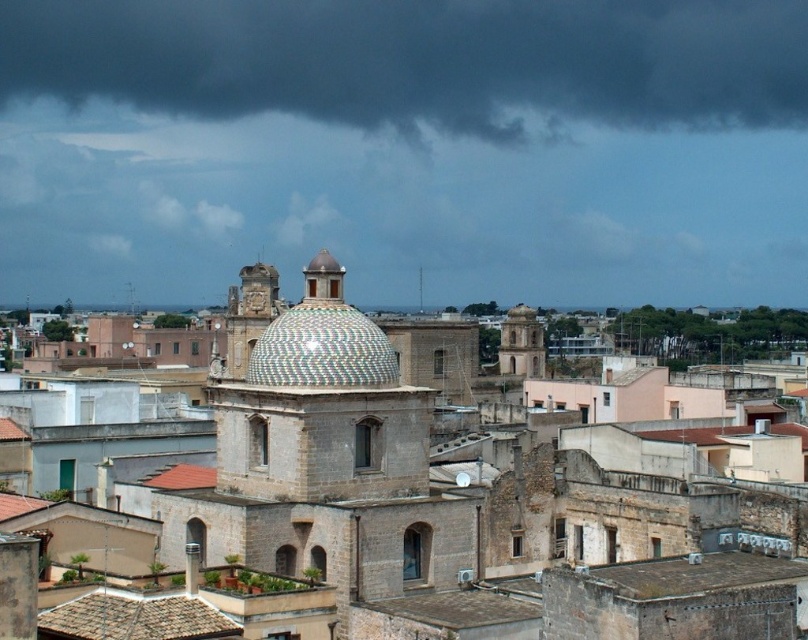
You are an architect analyzing the cityscape. You notice the dark gray cloud at upper center and the gray shingles roof at lower left. Which object is closer to your viewpoint?

The dark gray cloud at upper center is closer to the viewer than the gray shingles roof at lower left, as it is positioned further to the viewer in the scene.

You are standing in the city square and see the mosaic tile dome at center and the smooth stone tower at center. Which structure is closer to you?

The mosaic tile dome at center is closer to you because it is in front of the smooth stone tower at center.

You are standing in the city square and see the mosaic tile dome at center. If you want to take a photo of it from here, will the entire dome fit in your camera frame? Your camera has a maximum field of view that can capture objects up to 300 feet away.

The mosaic tile dome at center is 336.20 feet away from the viewer. Since your camera can only capture up to 300 feet, the entire dome will not fit in the frame.